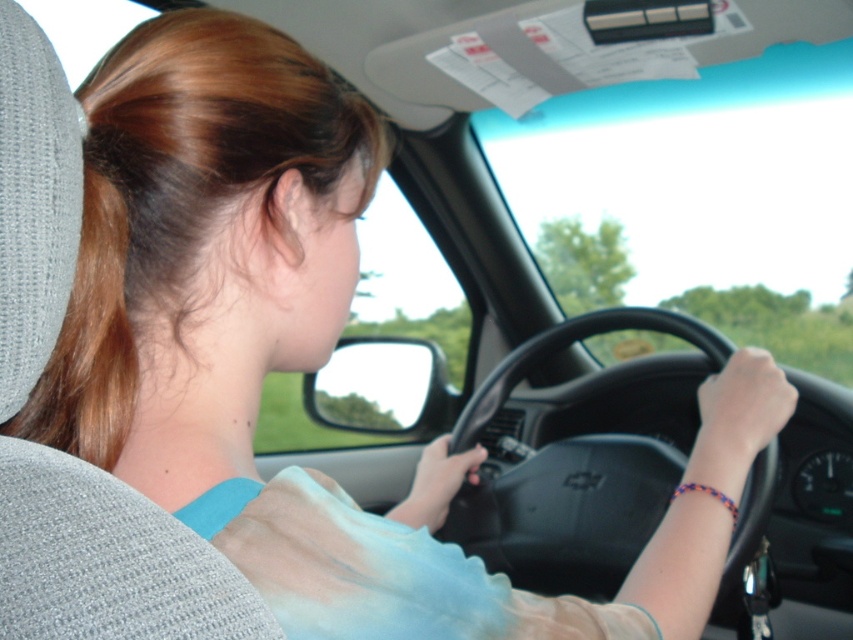
Does point (630, 324) come behind point (119, 352)?

Yes, it is behind point (119, 352).

Who is more forward, (x=647, y=493) or (x=90, y=154)?

Point (x=90, y=154) is in front.

The height and width of the screenshot is (640, 853). I want to click on black matte steering wheel at center, so click(x=567, y=513).